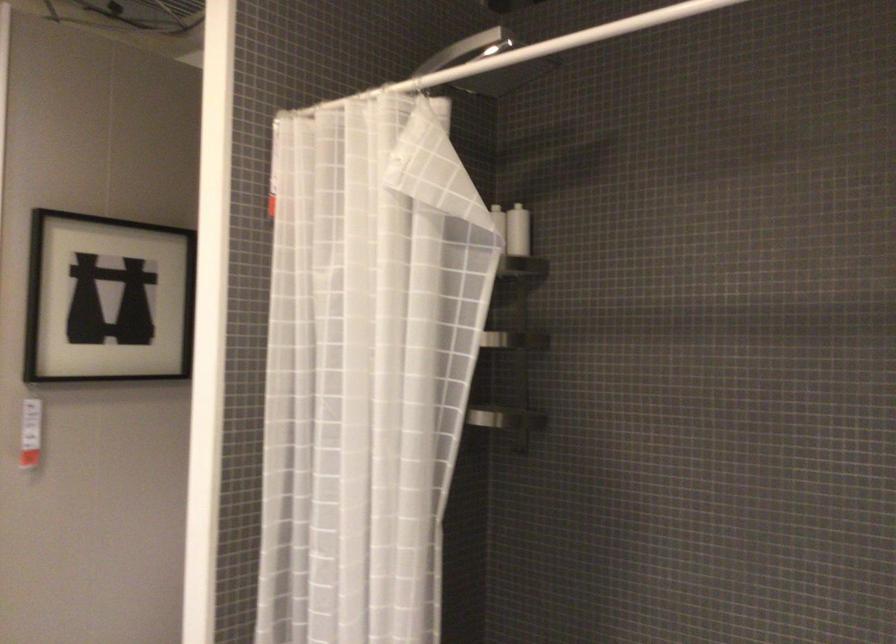
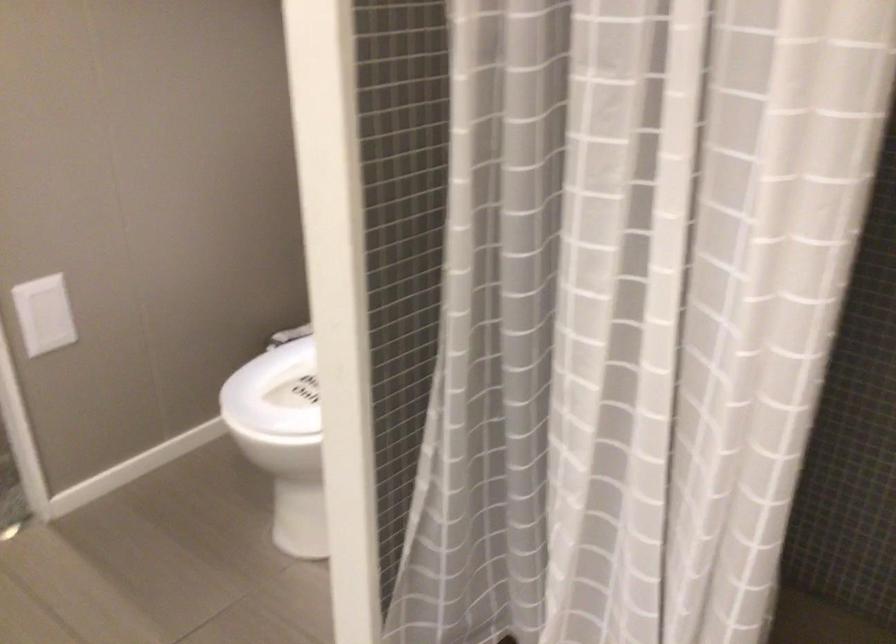
In a continuous first-person perspective shot, in which direction is the camera moving?

The cameraman moved toward left, forward.